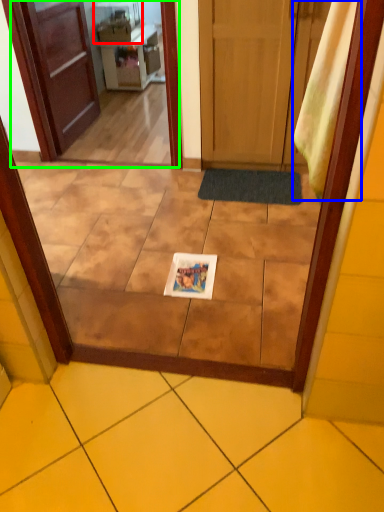
Question: Based on their relative distances, which object is nearer to appliance (highlighted by a red box)? Choose from curtain (highlighted by a blue box) and screen door (highlighted by a green box).

Choices:
 (A) curtain
 (B) screen door

Answer: (B)